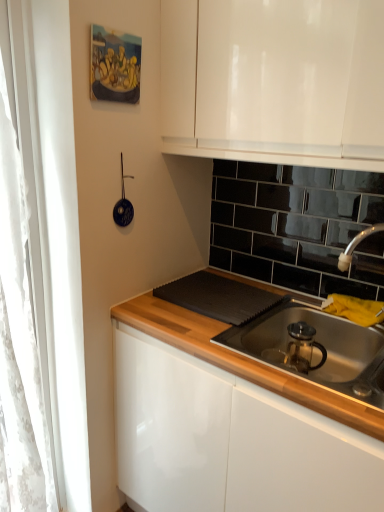
Question: From the image's perspective, is blue glossy strainer at upper left beneath stainless steel sink at lower right?

Choices:
 (A) yes
 (B) no

Answer: (B)

Question: Is blue glossy strainer at upper left thinner than stainless steel sink at lower right?

Choices:
 (A) yes
 (B) no

Answer: (A)

Question: Is blue glossy strainer at upper left closer to camera compared to stainless steel sink at lower right?

Choices:
 (A) no
 (B) yes

Answer: (A)

Question: Would you say blue glossy strainer at upper left contains stainless steel sink at lower right?

Choices:
 (A) no
 (B) yes

Answer: (A)

Question: Considering the relative sizes of blue glossy strainer at upper left and stainless steel sink at lower right in the image provided, is blue glossy strainer at upper left bigger than stainless steel sink at lower right?

Choices:
 (A) yes
 (B) no

Answer: (B)

Question: Is blue glossy strainer at upper left facing towards stainless steel sink at lower right?

Choices:
 (A) yes
 (B) no

Answer: (B)

Question: Is white lace curtain at left to the right of blue glossy strainer at upper left from the viewer's perspective?

Choices:
 (A) no
 (B) yes

Answer: (A)

Question: From a real-world perspective, is white lace curtain at left below blue glossy strainer at upper left?

Choices:
 (A) no
 (B) yes

Answer: (B)

Question: Is white lace curtain at left far away from blue glossy strainer at upper left?

Choices:
 (A) yes
 (B) no

Answer: (B)

Question: Is white lace curtain at left further to the viewer compared to blue glossy strainer at upper left?

Choices:
 (A) yes
 (B) no

Answer: (B)

Question: Is white lace curtain at left bigger than blue glossy strainer at upper left?

Choices:
 (A) yes
 (B) no

Answer: (A)

Question: Is white lace curtain at left outside of blue glossy strainer at upper left?

Choices:
 (A) yes
 (B) no

Answer: (A)

Question: Does stainless steel sink at lower right turn towards blue glossy strainer at upper left?

Choices:
 (A) no
 (B) yes

Answer: (A)